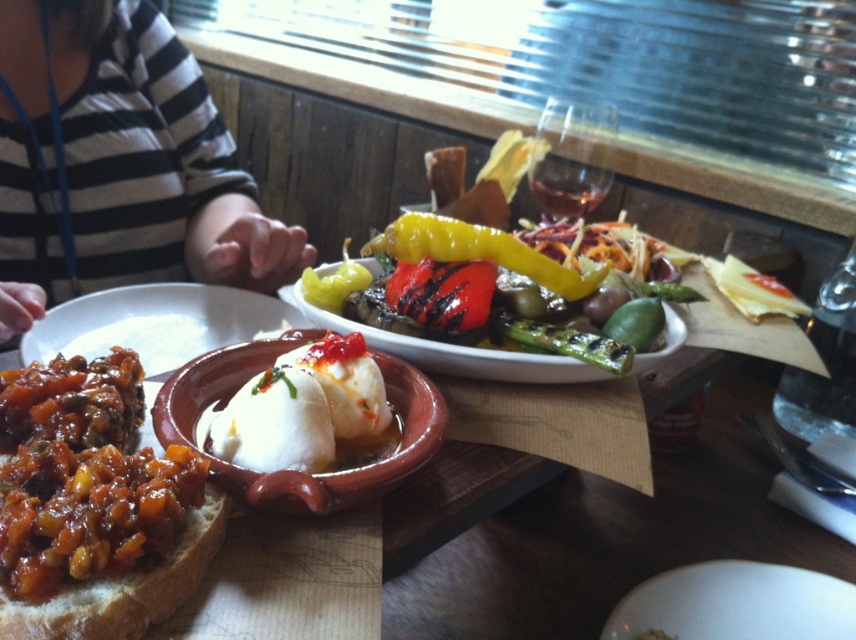
You are a server at the restaurant and need to place a new dish on the table. The dish requires a space wider than the striped fabric at upper left. Will the space next to the brown crusty bread at lower left be sufficient?

The striped fabric at upper left might be wider than the brown crusty bread at lower left, so the space next to the brown crusty bread at lower left may not be wide enough for the dish that requires a space wider than the striped fabric at upper left.

You are a waiter standing at the edge of the table. You need to place a new dish exactly at the center of the table. The table is a rectangle with coordinates ranging from 0 to 1 on both axes. Where should you place the dish relative to the shiny brown bread with chili topping at lower left?

The shiny brown bread with chili topping at lower left is located at point (82,476). To place the new dish at the center of the table, you should position it at coordinates (428,320), which is the midpoint between 0 and 1 on both axes. This places the dish centrally relative to the bread.